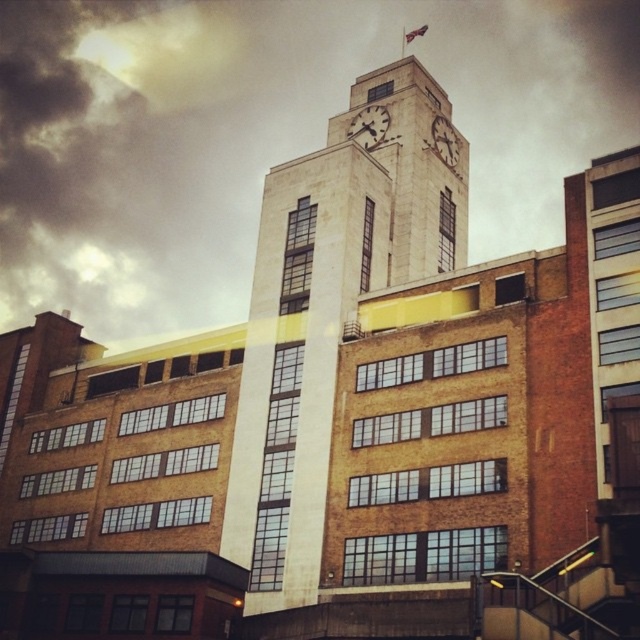
Which of these two, cloudy sky at upper center or beige stone clock tower at center, stands taller?

cloudy sky at upper center

Can you confirm if cloudy sky at upper center is wider than beige stone clock tower at center?

Yes.

Identify the location of cloudy sky at upper center. (266, 132).

Between point (410, 116) and point (449, 144), which one is positioned in front?

Point (410, 116) is more forward.

Which is more to the left, beige stone clock tower at center or white stone clock at upper center?

Positioned to the left is beige stone clock tower at center.

Who is more forward, (376, 221) or (436, 140)?

Point (376, 221) is in front.

Find the location of a particular element. The width and height of the screenshot is (640, 640). beige stone clock tower at center is located at coordinates (328, 314).

Consider the image. Can you confirm if metallic clock face at upper center is shorter than white stone clock at upper center?

Yes.

Is point (346, 132) farther from camera compared to point (433, 147)?

That is True.

Find the location of a particular element. This screenshot has width=640, height=640. metallic clock face at upper center is located at coordinates (369, 125).